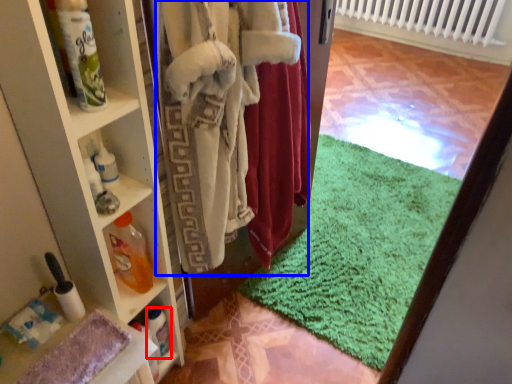
Question: Which object is closer to the camera taking this photo, bottle (highlighted by a red box) or clothing (highlighted by a blue box)?

Choices:
 (A) bottle
 (B) clothing

Answer: (B)